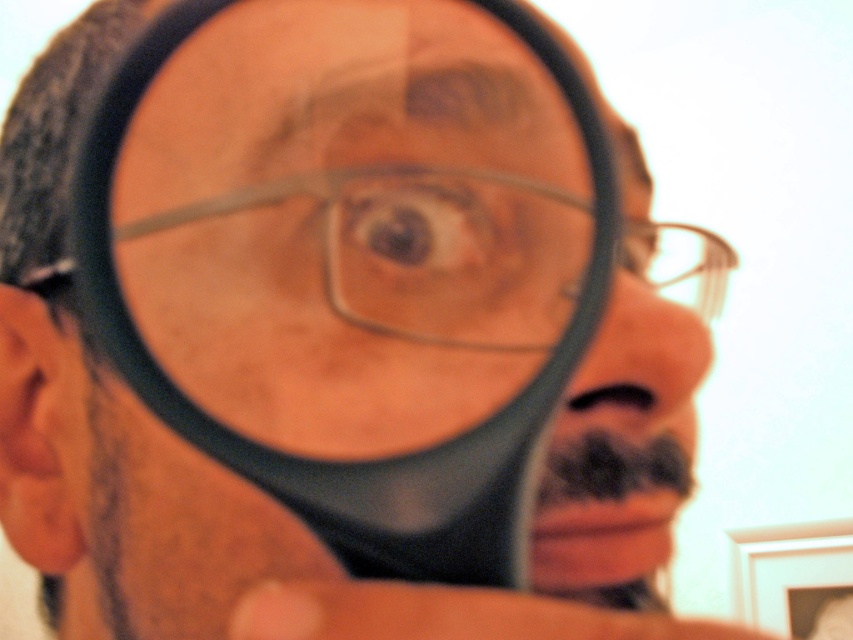
Can you confirm if clear plastic magnifying glass at center is wider than clear plastic glasses at center?

No, clear plastic magnifying glass at center is not wider than clear plastic glasses at center.

Between clear plastic magnifying glass at center and clear plastic glasses at center, which one appears on the right side from the viewer's perspective?

clear plastic glasses at center

Does point (404, 172) come farther from viewer compared to point (372, 202)?

No, it is not.

Where is `clear plastic magnifying glass at center`? This screenshot has width=853, height=640. clear plastic magnifying glass at center is located at coordinates (352, 260).